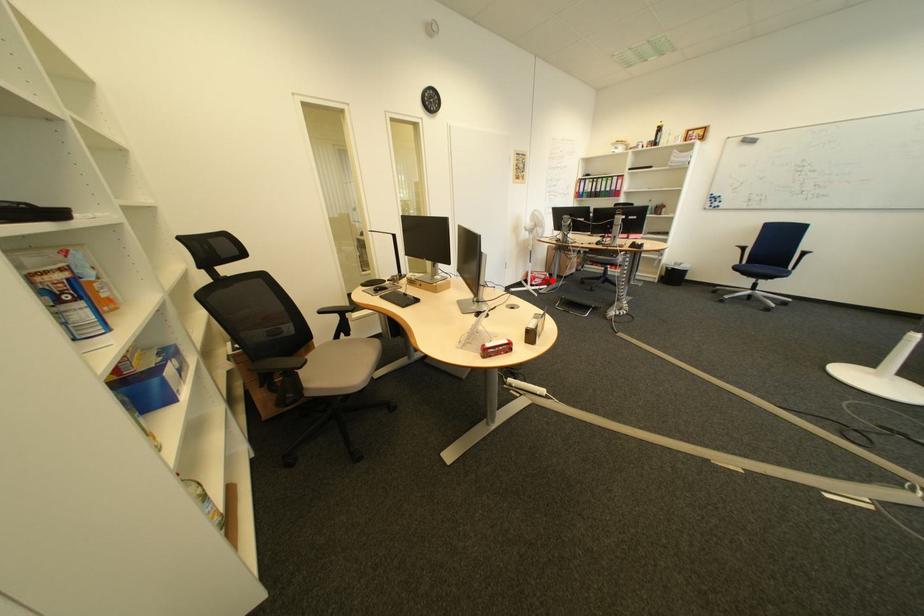
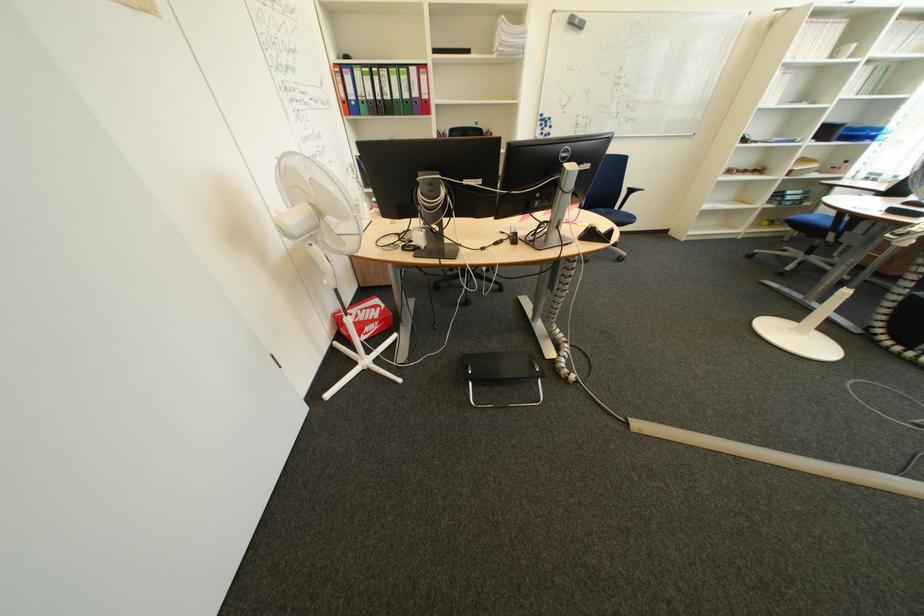
Question: I am providing you with two images of the same scene from different viewpoints. A red point is marked on the first image. At the location where the point appears in image 1, is it still visible in image 2?

Choices:
 (A) Yes
 (B) No

Answer: (A)